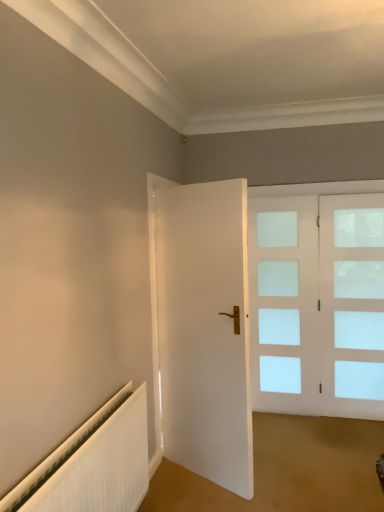
Question: Considering the positions of clear glass door at right and white matte door at center in the image, is clear glass door at right wider or thinner than white matte door at center?

Choices:
 (A) wide
 (B) thin

Answer: (B)

Question: Considering their positions, is clear glass door at right located in front of or behind white matte door at center?

Choices:
 (A) front
 (B) behind

Answer: (B)

Question: Considering the real-world distances, which object is farthest from the white ribbed radiator at lower left?

Choices:
 (A) white matte door at center
 (B) clear glass door at right

Answer: (B)

Question: Estimate the real-world distances between objects in this image. Which object is farther from the clear glass door at right?

Choices:
 (A) white ribbed radiator at lower left
 (B) white matte door at center

Answer: (A)